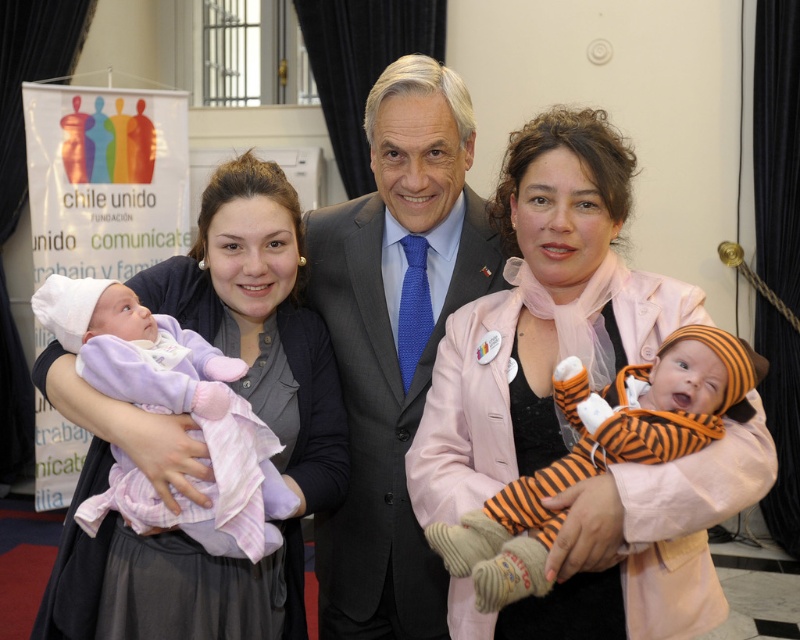
Does matte gray blazer at center have a smaller size compared to matte purple blanket at left?

Incorrect, matte gray blazer at center is not smaller in size than matte purple blanket at left.

Which is more to the right, matte gray blazer at center or matte purple blanket at left?

matte gray blazer at center is more to the right.

Who is more forward, (176, 554) or (106, 348)?

Positioned in front is point (106, 348).

Locate an element on the screen. matte gray blazer at center is located at coordinates (x=197, y=440).

Can you confirm if matte gray blazer at center is bigger than orange striped onesie at center?

Indeed, matte gray blazer at center has a larger size compared to orange striped onesie at center.

Does matte gray blazer at center have a lesser height compared to orange striped onesie at center?

Incorrect, matte gray blazer at center's height does not fall short of orange striped onesie at center's.

Who is more distant from viewer, (220, 260) or (672, 445)?

Point (220, 260)

In order to click on matte gray blazer at center in this screenshot , I will do `click(197, 440)`.

Is orange striped onesie at center closer to the viewer compared to matte purple blanket at left?

Yes, orange striped onesie at center is in front of matte purple blanket at left.

Does point (546, 481) come in front of point (200, 381)?

Yes.

Is point (526, 576) behind point (141, 404)?

No, (526, 576) is in front of (141, 404).

Where is `orange striped onesie at center`? The image size is (800, 640). orange striped onesie at center is located at coordinates (600, 452).